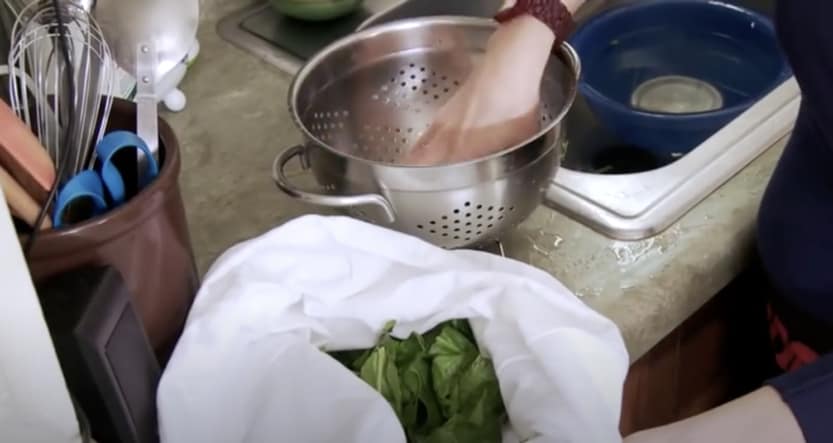
Where is `white cloth`? The image size is (833, 443). white cloth is located at coordinates (302, 290).